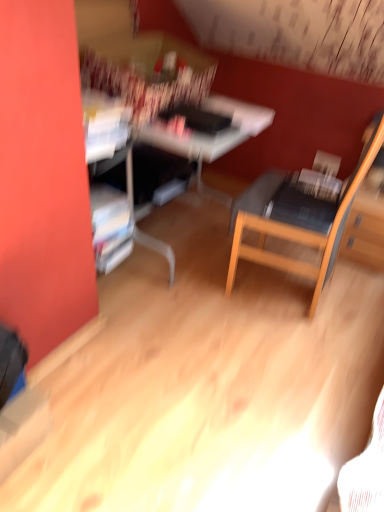
I want to click on wooden chair at center-right, so click(x=299, y=221).

This screenshot has width=384, height=512. What do you see at coordinates (299, 221) in the screenshot? I see `wooden chair at center-right` at bounding box center [299, 221].

Measure the distance between point (172, 129) and camera.

Point (172, 129) is 5.48 feet from camera.

What do you see at coordinates (209, 135) in the screenshot? I see `white glossy computer desk at center` at bounding box center [209, 135].

In order to face white glossy computer desk at center, should I rotate leftwards or rightwards?

To align with it, rotate left about 4.653°.

You are a GUI agent. You are given a task and a screenshot of the screen. Output one action in this format:
    pyautogui.click(x=<x>, y=<y>)
    Task: Click on the white glossy computer desk at center
    
    Given the screenshot: What is the action you would take?
    pyautogui.click(x=209, y=135)

This screenshot has height=512, width=384. I want to click on wooden chair at center-right, so click(299, 221).

Between white glossy computer desk at center and wooden chair at center-right, which one appears on the left side from the viewer's perspective?

white glossy computer desk at center is more to the left.

Consider the image. Does white glossy computer desk at center lie behind wooden chair at center-right?

Yes, white glossy computer desk at center is further from the camera.

Which point is more distant from viewer, (x=102, y=206) or (x=287, y=231)?

Positioned behind is point (x=102, y=206).

Based on the photo, from the image's perspective, is white glossy computer desk at center on top of wooden chair at center-right?

Indeed, from the image's perspective, white glossy computer desk at center is shown above wooden chair at center-right.

From a real-world perspective, is white glossy computer desk at center above or below wooden chair at center-right?

Clearly, from a real-world perspective, white glossy computer desk at center is below wooden chair at center-right.

In the scene shown: Can you confirm if white glossy computer desk at center is wider than wooden chair at center-right?

Indeed, white glossy computer desk at center has a greater width compared to wooden chair at center-right.

Which of these two, white glossy computer desk at center or wooden chair at center-right, stands taller?

wooden chair at center-right is taller.

Which of these two, white glossy computer desk at center or wooden chair at center-right, is smaller?

With smaller size is wooden chair at center-right.

Is white glossy computer desk at center surrounding wooden chair at center-right?

No, wooden chair at center-right is not a part of white glossy computer desk at center.

Are white glossy computer desk at center and wooden chair at center-right beside each other?

No, white glossy computer desk at center is not touching wooden chair at center-right.

Could you tell me if white glossy computer desk at center is turned towards wooden chair at center-right?

Yes.

What's the angular difference between white glossy computer desk at center and wooden chair at center-right's facing directions?

176 degrees.

Where is `chair located in front of the white glossy computer desk at center`? chair located in front of the white glossy computer desk at center is located at coordinates [299, 221].

Can you confirm if wooden chair at center-right is positioned to the left of white glossy computer desk at center?

Incorrect, wooden chair at center-right is not on the left side of white glossy computer desk at center.

Who is more distant, wooden chair at center-right or white glossy computer desk at center?

Positioned behind is white glossy computer desk at center.

Which is nearer, (x=282, y=205) or (x=152, y=130)?

Clearly, point (x=282, y=205) is closer to the camera than point (x=152, y=130).

From the image's perspective, who appears lower, wooden chair at center-right or white glossy computer desk at center?

wooden chair at center-right is shown below in the image.

From a real-world perspective, is wooden chair at center-right positioned over white glossy computer desk at center based on gravity?

Yes, from a real-world perspective, wooden chair at center-right is above white glossy computer desk at center.

Between wooden chair at center-right and white glossy computer desk at center, which one has larger width?

white glossy computer desk at center.

Does wooden chair at center-right have a greater height compared to white glossy computer desk at center?

Correct, wooden chair at center-right is much taller as white glossy computer desk at center.

Can you confirm if wooden chair at center-right is smaller than white glossy computer desk at center?

Yes.

Is wooden chair at center-right not inside white glossy computer desk at center?

wooden chair at center-right is positioned outside white glossy computer desk at center.

Is wooden chair at center-right far away from white glossy computer desk at center?

No, wooden chair at center-right is in close proximity to white glossy computer desk at center.

Could you tell me if wooden chair at center-right is facing white glossy computer desk at center?

Yes, wooden chair at center-right faces towards white glossy computer desk at center.

Where is `chair below the white glossy computer desk at center (from the image's perspective)`? Image resolution: width=384 pixels, height=512 pixels. chair below the white glossy computer desk at center (from the image's perspective) is located at coordinates (299, 221).

This screenshot has height=512, width=384. I want to click on computer desk behind the wooden chair at center-right, so click(x=209, y=135).

Where is `computer desk directly beneath the wooden chair at center-right (from a real-world perspective)`? This screenshot has width=384, height=512. computer desk directly beneath the wooden chair at center-right (from a real-world perspective) is located at coordinates (209, 135).